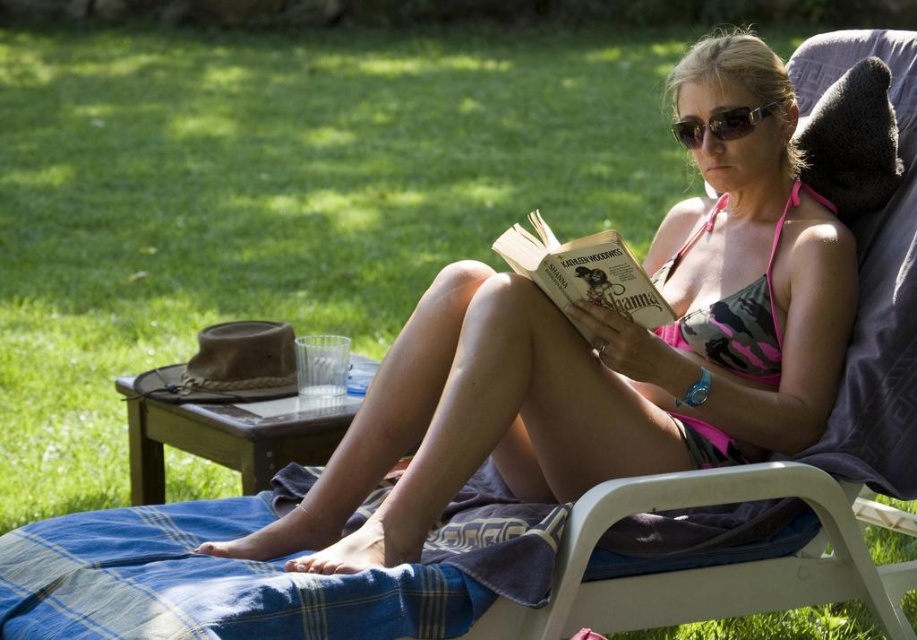
Question: Which point is farther to the camera?

Choices:
 (A) (373, 497)
 (B) (634, 294)
 (C) (757, 124)
 (D) (717, 436)

Answer: (A)

Question: Considering the relative positions of hardcover book at center and black plastic sunglasses at center in the image provided, where is hardcover book at center located with respect to black plastic sunglasses at center?

Choices:
 (A) below
 (B) above

Answer: (A)

Question: Is blue plaid blanket at lower center above hardcover book at center?

Choices:
 (A) no
 (B) yes

Answer: (A)

Question: Which of the following is the closest to the observer?

Choices:
 (A) blue plaid blanket at lower center
 (B) pink camouflage bikini at center
 (C) black plastic sunglasses at center

Answer: (A)

Question: Is hardcover book at center positioned behind black plastic sunglasses at center?

Choices:
 (A) yes
 (B) no

Answer: (B)

Question: Which object is the closest to the black plastic sunglasses at center?

Choices:
 (A) hardcover book at center
 (B) pink camouflage bikini at center

Answer: (A)